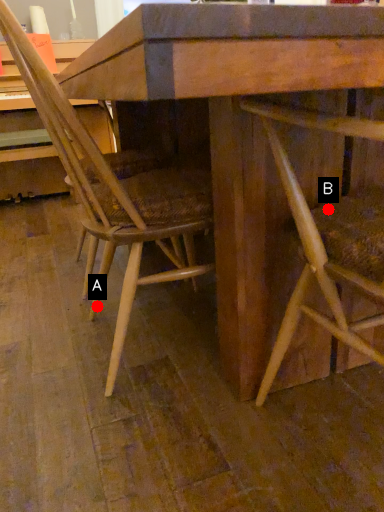
Question: Two points are circled on the image, labeled by A and B beside each circle. Which of the following is the farthest from the observer?

Choices:
 (A) A is further
 (B) B is further

Answer: (A)